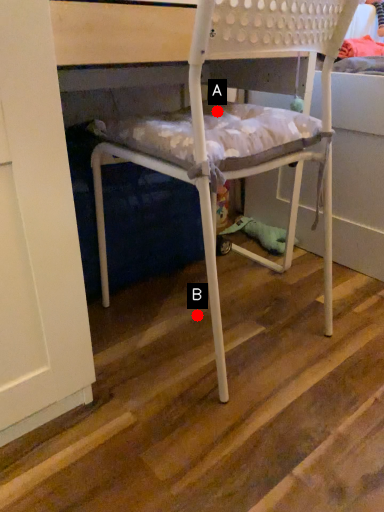
Question: Two points are circled on the image, labeled by A and B beside each circle. Which point is farther from the camera taking this photo?

Choices:
 (A) A is further
 (B) B is further

Answer: (B)